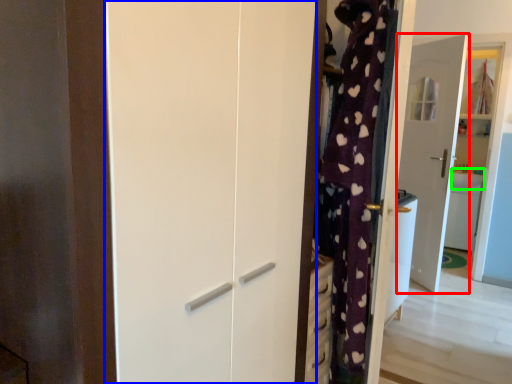
Question: Which is farther away from door (highlighted by a red box)? screen door (highlighted by a blue box) or counter top (highlighted by a green box)?

Choices:
 (A) screen door
 (B) counter top

Answer: (A)